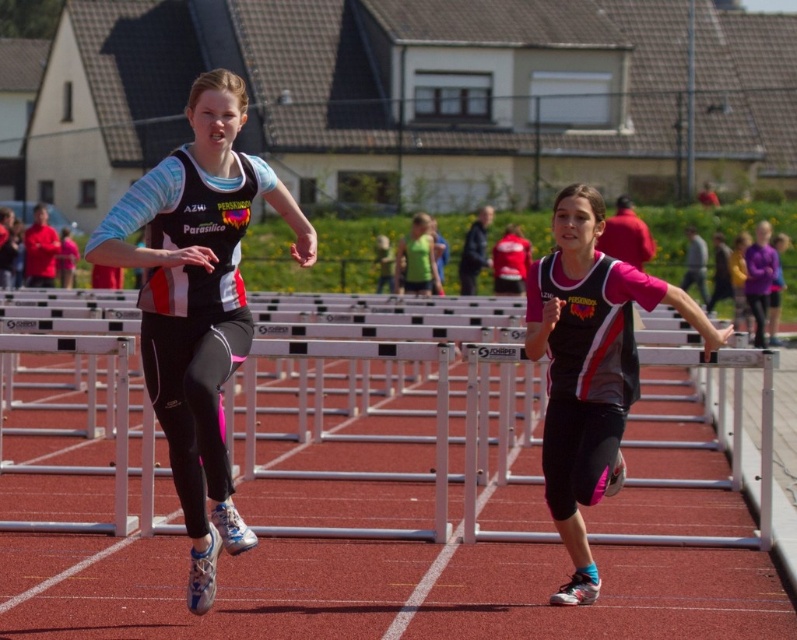
Question: Does white metal hurdle at center have a greater width compared to matte black vest at left?

Choices:
 (A) yes
 (B) no

Answer: (B)

Question: Is matte black vest at left below pink matte shorts at center?

Choices:
 (A) yes
 (B) no

Answer: (B)

Question: Among these objects, which one is farthest from the camera?

Choices:
 (A) matte black vest at left
 (B) metallic silver hurdle at center
 (C) white metal hurdle at center
 (D) pink matte shorts at center

Answer: (C)

Question: Does matte black vest at left appear on the right side of pink matte shorts at center?

Choices:
 (A) yes
 (B) no

Answer: (B)

Question: Which is nearer to the pink matte shorts at center?

Choices:
 (A) metallic silver hurdle at center
 (B) white metal hurdle at center
 (C) matte black vest at left

Answer: (A)

Question: Considering the real-world distances, which object is farthest from the metallic silver hurdle at center?

Choices:
 (A) pink matte shorts at center
 (B) white metal hurdle at center

Answer: (B)